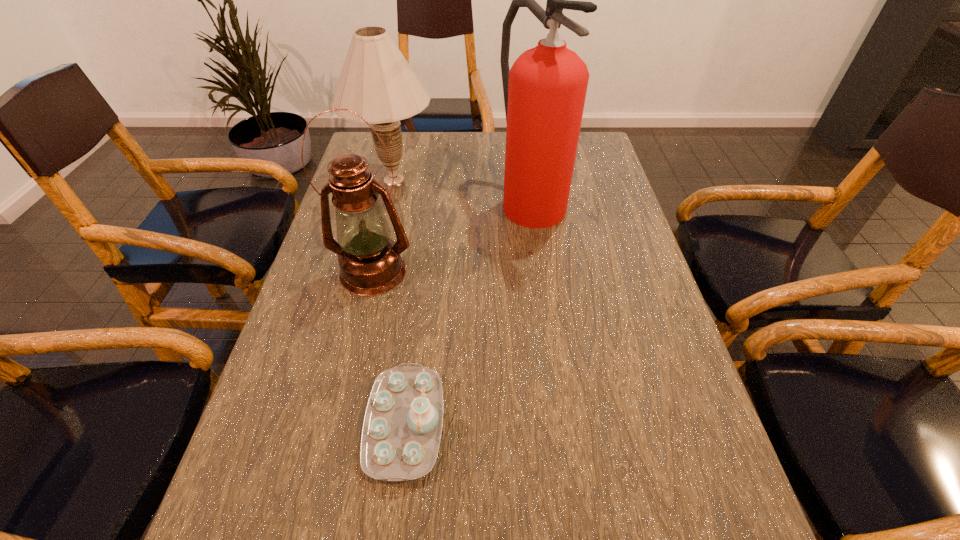
Find the location of a particular element. This screenshot has height=540, width=960. fire extinguisher located in the far edge section of the desktop is located at coordinates (544, 91).

Locate an element on the screen. lampshade positioned at the far edge is located at coordinates (376, 82).

This screenshot has width=960, height=540. Identify the location of lampshade at the left edge. (376, 82).

Locate an element on the screen. This screenshot has height=540, width=960. oil lamp at the left edge is located at coordinates (370, 263).

The image size is (960, 540). Identify the location of object situated at the right edge. (544, 91).

Image resolution: width=960 pixels, height=540 pixels. In order to click on object that is at the far left corner in this screenshot , I will do `click(376, 82)`.

What are the coordinates of `object situated at the far right corner` in the screenshot? It's located at (544, 91).

I want to click on vacant space at the far edge of the desktop, so click(505, 159).

The height and width of the screenshot is (540, 960). In the image, there is a desktop. What are the coordinates of `free space at the left edge` in the screenshot? It's located at (331, 319).

The image size is (960, 540). I want to click on free spot at the right edge of the desktop, so click(x=580, y=219).